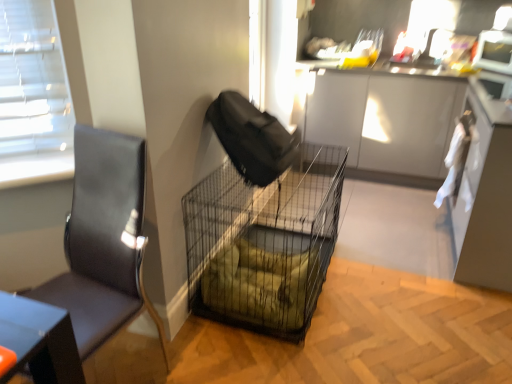
This screenshot has width=512, height=384. Identify the location of vacant area to the right of black wire mesh cage at center. (394, 303).